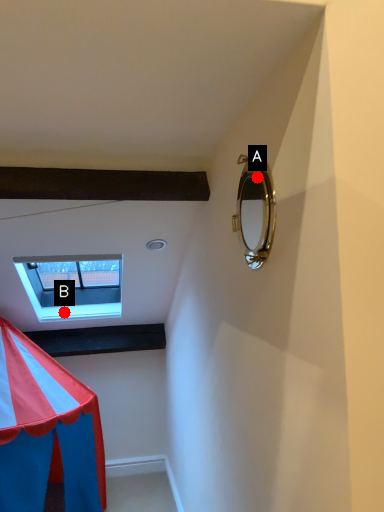
Question: Two points are circled on the image, labeled by A and B beside each circle. Among these points, which one is nearest to the camera?

Choices:
 (A) A is closer
 (B) B is closer

Answer: (A)